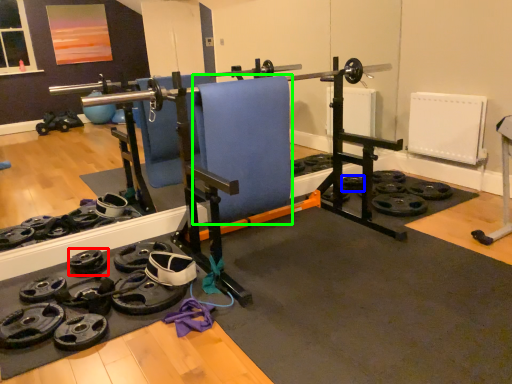
Question: Estimate the real-world distances between objects in this image. Which object is farther from wheel (highlighted by a red box), wheel (highlighted by a blue box) or swivel chair (highlighted by a green box)?

Choices:
 (A) wheel
 (B) swivel chair

Answer: (A)